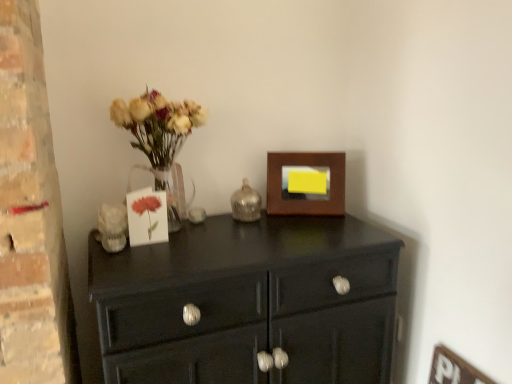
This screenshot has height=384, width=512. What are the coordinates of `free space in front of matte glass vase with dried flowers at left` in the screenshot? It's located at (165, 264).